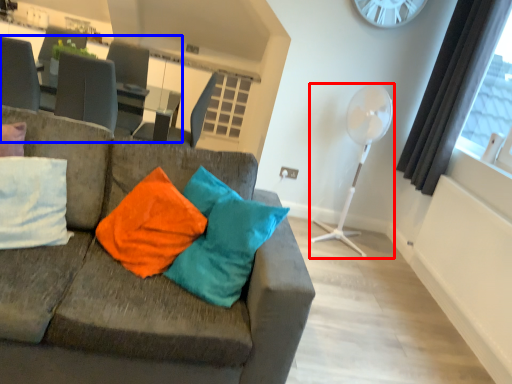
Question: Among these objects, which one is nearest to the camera, fan (highlighted by a red box) or table (highlighted by a blue box)?

Choices:
 (A) fan
 (B) table

Answer: (A)